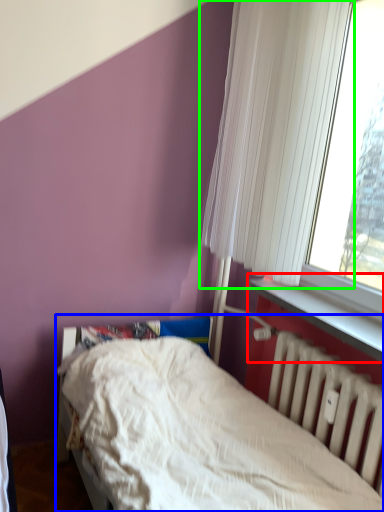
Question: Considering the real-world distances, which object is closest to window sill (highlighted by a red box)? bed (highlighted by a blue box) or curtain (highlighted by a green box).

Choices:
 (A) bed
 (B) curtain

Answer: (A)